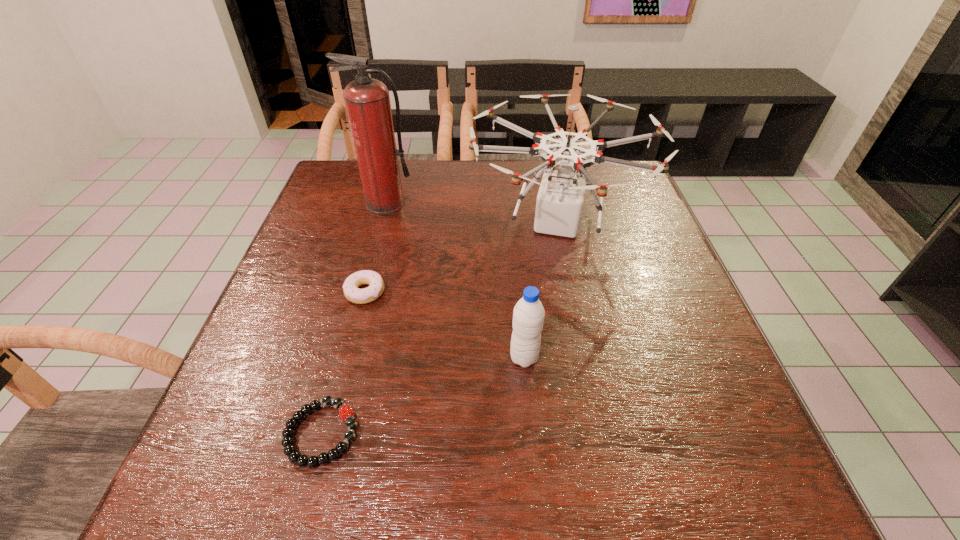
Locate an element on the screen. The image size is (960, 540). vacant region that satisfies the following two spatial constraints: 1. at the nozzle of the drone; 2. on the left side of the fire extinguisher is located at coordinates (381, 222).

You are a GUI agent. You are given a task and a screenshot of the screen. Output one action in this format:
    pyautogui.click(x=<x>, y=<y>)
    Task: Click on the vacant area that satisfies the following two spatial constraints: 1. at the nozzle of the drone; 2. on the right side of the tallest object
    
    Given the screenshot: What is the action you would take?
    pyautogui.click(x=381, y=222)

Identify the location of vacant space that satisfies the following two spatial constraints: 1. at the nozzle of the fourth farthest object; 2. on the left side of the fire extinguisher. [346, 357].